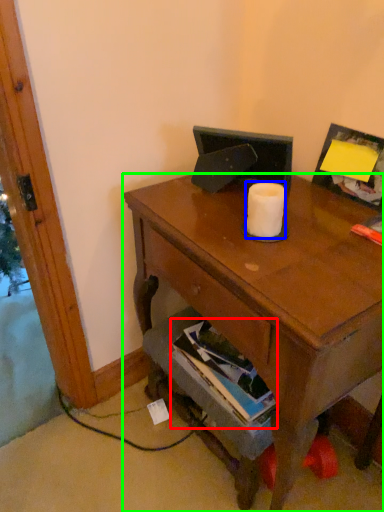
Question: Which is farther away from book (highlighted by a red box)? toilet paper (highlighted by a blue box) or desk (highlighted by a green box)?

Choices:
 (A) toilet paper
 (B) desk

Answer: (A)